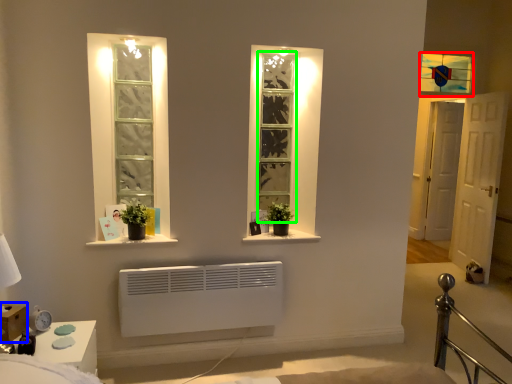
Question: Which is farther away from window (highlighted by a red box)? window box (highlighted by a blue box) or bay window (highlighted by a green box)?

Choices:
 (A) window box
 (B) bay window

Answer: (A)